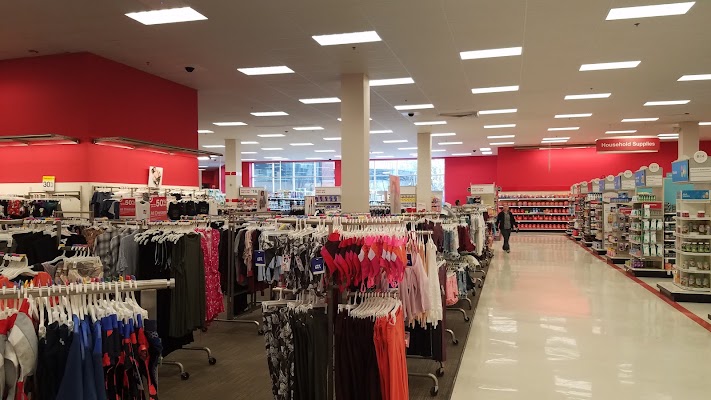
Where is `red walls`? This screenshot has height=400, width=711. red walls is located at coordinates click(x=109, y=171), click(x=498, y=170).